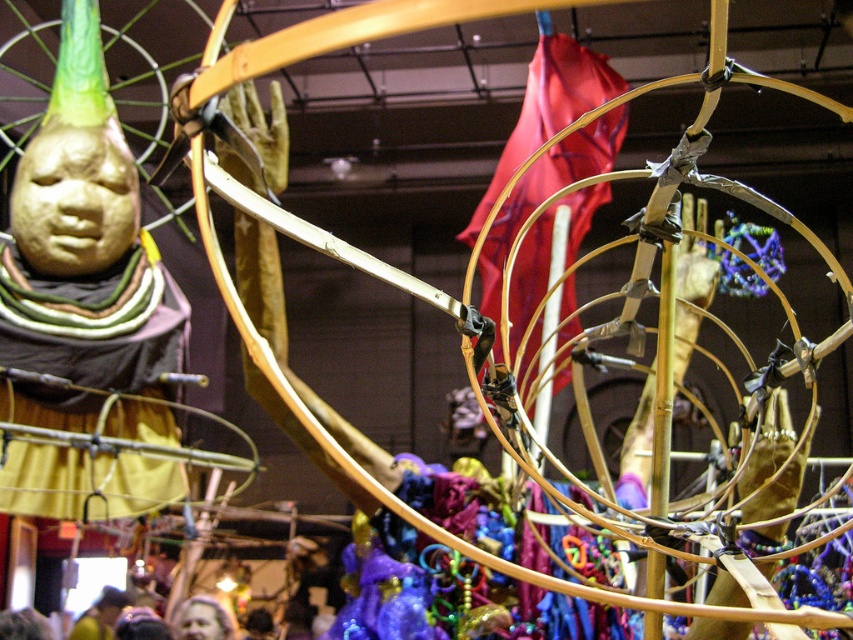
You are an art curator planning to photograph the installation. You need to ensure that the smooth skin face at lower center and the yellow fabric at lower left are both visible in the frame. Given their sizes, which object should you prioritize positioning closer to the camera to maintain clarity?

The smooth skin face at lower center is larger in size than the yellow fabric at lower left, so you should prioritize positioning the yellow fabric at lower left closer to the camera to maintain clarity since smaller objects need to be closer for clear visibility.

You are an art critic observing the installation. You notice the smooth skin face at lower center and the yellow fabric at lower left. Which object is closer to you from your vantage point?

The smooth skin face at lower center is closer to you because it is in front of the yellow fabric at lower left.

You are an art critic analyzing the installation. You notice two elements in the foreground near the base of the sculpture. The first is a smooth skin face at lower center, and the second is a yellow fabric at lower left. Based on their positions, which one is located more to the left?

The yellow fabric at lower left is more to the left since the smooth skin face at lower center is positioned to its right.